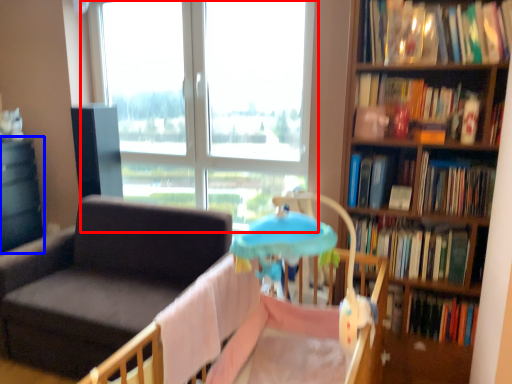
Question: Which of the following is the closest to the observer, window (highlighted by a red box) or table (highlighted by a blue box)?

Choices:
 (A) window
 (B) table

Answer: (A)